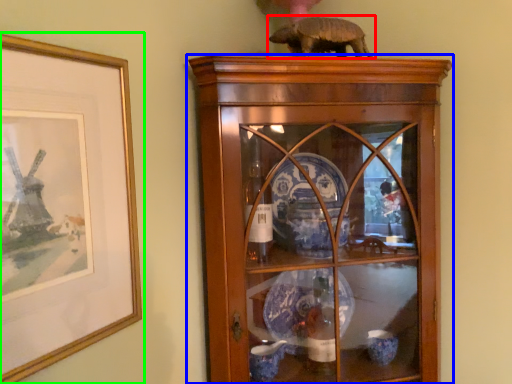
Question: Considering the real-world distances, which object is farthest from animal (highlighted by a red box)? shelf (highlighted by a blue box) or picture frame (highlighted by a green box)?

Choices:
 (A) shelf
 (B) picture frame

Answer: (B)